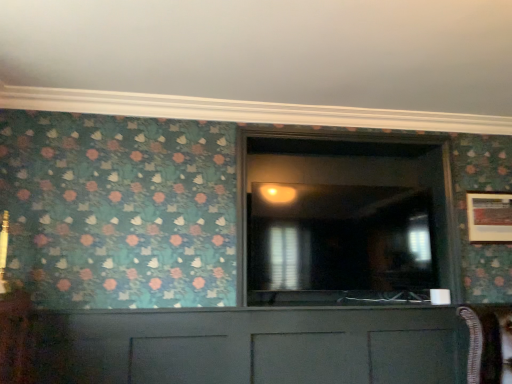
Question: Choose the correct answer: Is matte gray cabinet at center inside transparent glass door at center or outside it?

Choices:
 (A) inside
 (B) outside

Answer: (B)

Question: Considering the relative positions of matte gray cabinet at center and transparent glass door at center in the image provided, is matte gray cabinet at center to the left or to the right of transparent glass door at center?

Choices:
 (A) left
 (B) right

Answer: (A)

Question: Which is nearer to the wooden picture frame at right?

Choices:
 (A) transparent glass door at center
 (B) matte gray cabinet at center

Answer: (A)

Question: Which is nearer to the transparent glass door at center?

Choices:
 (A) matte gray cabinet at center
 (B) wooden picture frame at right

Answer: (A)